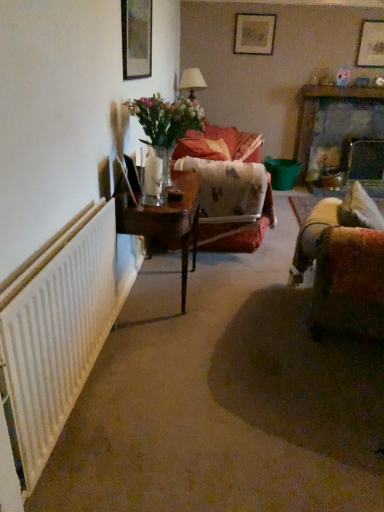
Question: Are wooden picture frame at upper left, the 3th picture frame positioned from the right, and velvet brown couch at right far apart?

Choices:
 (A) no
 (B) yes

Answer: (B)

Question: Is wooden picture frame at upper left, acting as the 1th picture frame starting from the left, located outside velvet brown couch at right?

Choices:
 (A) no
 (B) yes

Answer: (B)

Question: Is wooden picture frame at upper left, positioned as the third picture frame in back-to-front order, in contact with velvet brown couch at right?

Choices:
 (A) yes
 (B) no

Answer: (B)

Question: Does wooden picture frame at upper left, positioned as the first picture frame in front-to-back order, come behind velvet brown couch at right?

Choices:
 (A) no
 (B) yes

Answer: (B)

Question: Is wooden picture frame at upper left, positioned as the first picture frame in front-to-back order, at the right side of velvet brown couch at right?

Choices:
 (A) yes
 (B) no

Answer: (B)

Question: Does point (167, 205) appear closer or farther from the camera than point (380, 33)?

Choices:
 (A) closer
 (B) farther

Answer: (A)

Question: From the image's perspective, relative to wooden picture frame at upper right, the 2th picture frame in the front-to-back sequence, is wooden table at center above or below?

Choices:
 (A) above
 (B) below

Answer: (B)

Question: Relative to wooden picture frame at upper right, the 2th picture frame in the front-to-back sequence, is wooden table at center in front or behind?

Choices:
 (A) front
 (B) behind

Answer: (A)

Question: Looking at the image, does wooden table at center seem bigger or smaller compared to wooden picture frame at upper right, the 2th picture frame in the front-to-back sequence?

Choices:
 (A) big
 (B) small

Answer: (A)

Question: From a real-world perspective, relative to velvet floral couch at center, is clear glass vase at center vertically above or below?

Choices:
 (A) above
 (B) below

Answer: (A)

Question: Is clear glass vase at center taller or shorter than velvet floral couch at center?

Choices:
 (A) tall
 (B) short

Answer: (B)

Question: Considering the positions of clear glass vase at center and velvet floral couch at center in the image, is clear glass vase at center bigger or smaller than velvet floral couch at center?

Choices:
 (A) small
 (B) big

Answer: (A)

Question: From the image's perspective, is clear glass vase at center located above or below velvet floral couch at center?

Choices:
 (A) above
 (B) below

Answer: (B)

Question: Visually, is matte wooden picture frame at upper center, the first picture frame when ordered from top to bottom, positioned to the left or to the right of velvet floral couch at center?

Choices:
 (A) left
 (B) right

Answer: (B)

Question: Choose the correct answer: Is matte wooden picture frame at upper center, the second picture frame in the right-to-left sequence, inside velvet floral couch at center or outside it?

Choices:
 (A) inside
 (B) outside

Answer: (B)